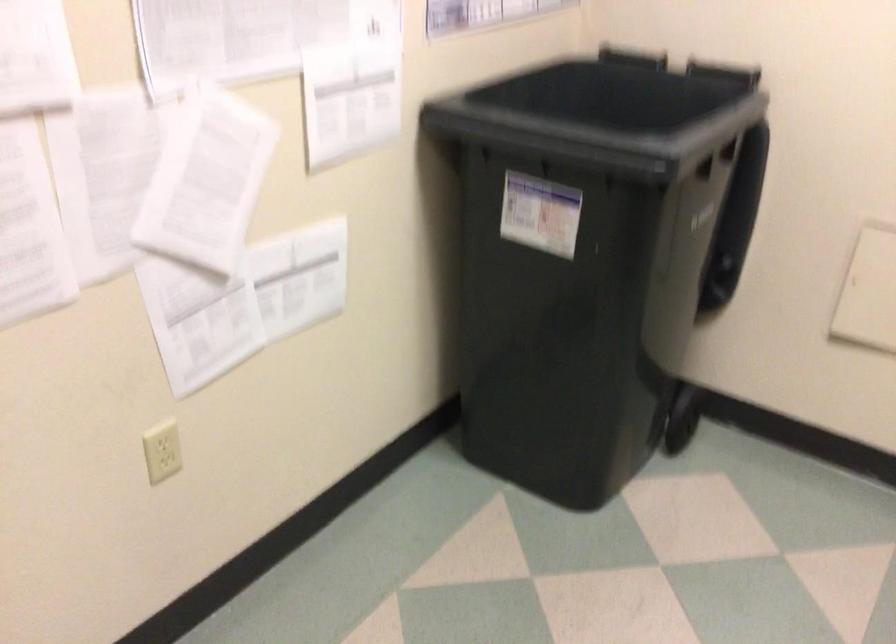
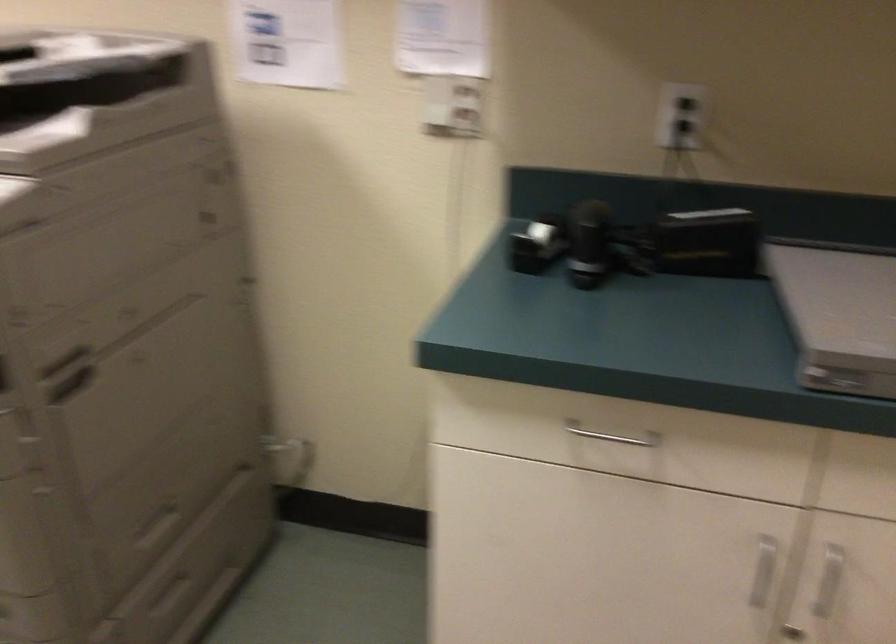
First-person continuous shooting, in which direction is the camera rotating?

The camera rotated toward right-down.